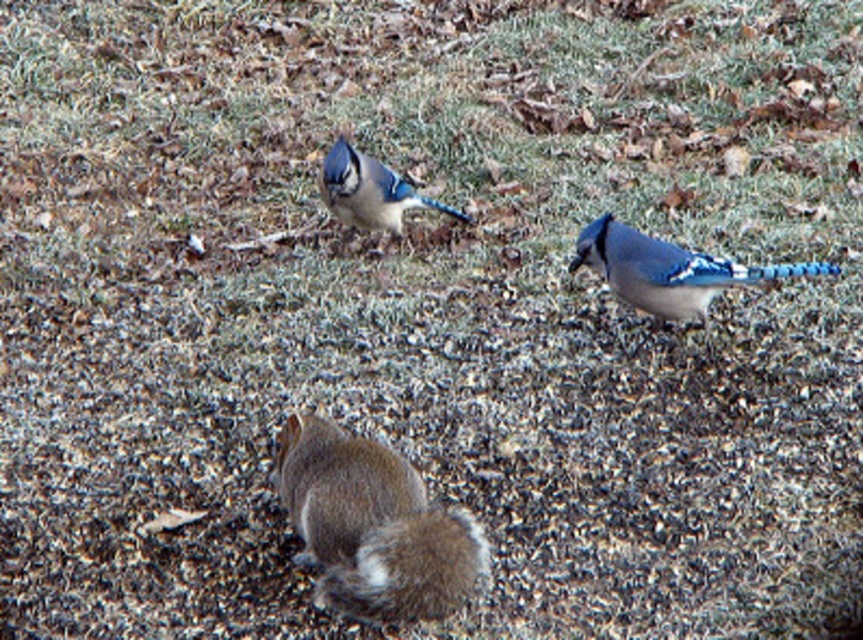
Question: Is blue glossy bird at upper right to the left of blue glossy bird at center from the viewer's perspective?

Choices:
 (A) yes
 (B) no

Answer: (B)

Question: Which object is the closest to the blue glossy bird at upper right?

Choices:
 (A) blue glossy bird at center
 (B) fuzzy brown squirrel at center

Answer: (A)

Question: Is blue glossy bird at upper right wider than blue glossy bird at center?

Choices:
 (A) no
 (B) yes

Answer: (B)

Question: Which object appears closest to the camera in this image?

Choices:
 (A) blue glossy bird at center
 (B) fuzzy brown squirrel at center

Answer: (B)

Question: Is fuzzy brown squirrel at center thinner than blue glossy bird at center?

Choices:
 (A) no
 (B) yes

Answer: (A)

Question: Which of these objects is positioned farthest from the fuzzy brown squirrel at center?

Choices:
 (A) blue glossy bird at center
 (B) blue glossy bird at upper right

Answer: (A)